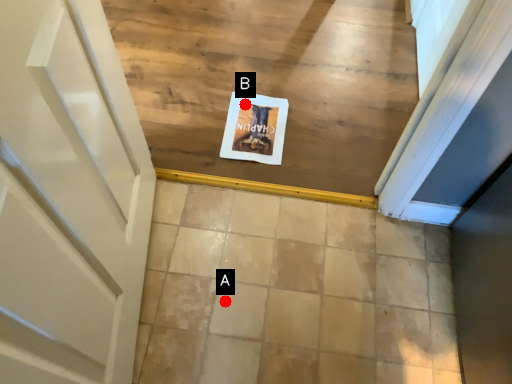
Question: Two points are circled on the image, labeled by A and B beside each circle. Which point is closer to the camera?

Choices:
 (A) A is closer
 (B) B is closer

Answer: (A)